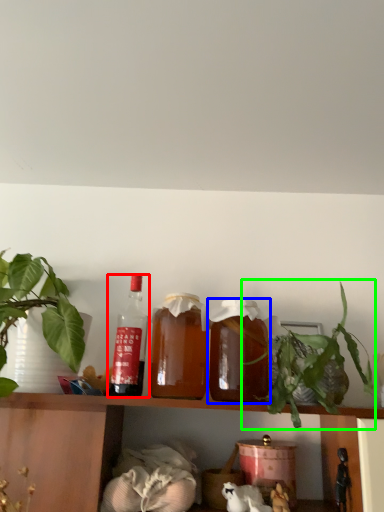
Question: Considering the real-world distances, which object is farthest from bottle (highlighted by a red box)? bottle (highlighted by a blue box) or houseplant (highlighted by a green box)?

Choices:
 (A) bottle
 (B) houseplant

Answer: (B)